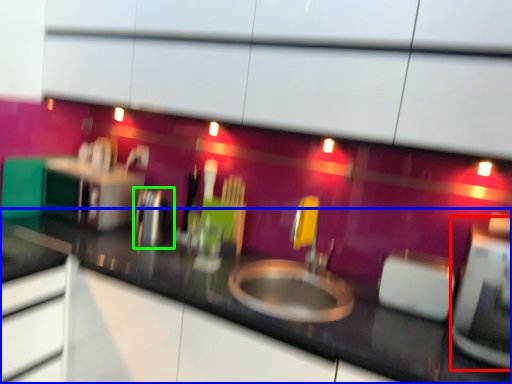
Question: Based on their relative distances, which object is farther from appliance (highlighted by a red box)? Choose from countertop (highlighted by a blue box) and appliance (highlighted by a green box).

Choices:
 (A) countertop
 (B) appliance

Answer: (B)